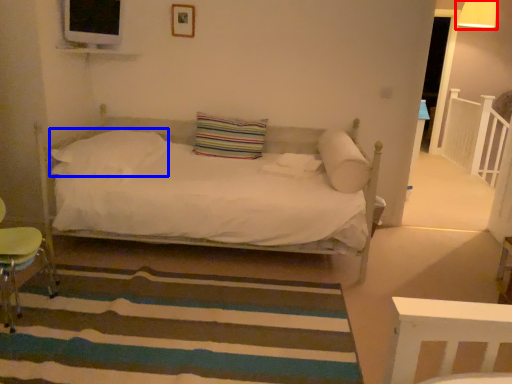
Question: Among these objects, which one is nearest to the camera, lamp (highlighted by a red box) or pillow (highlighted by a blue box)?

Choices:
 (A) lamp
 (B) pillow

Answer: (B)